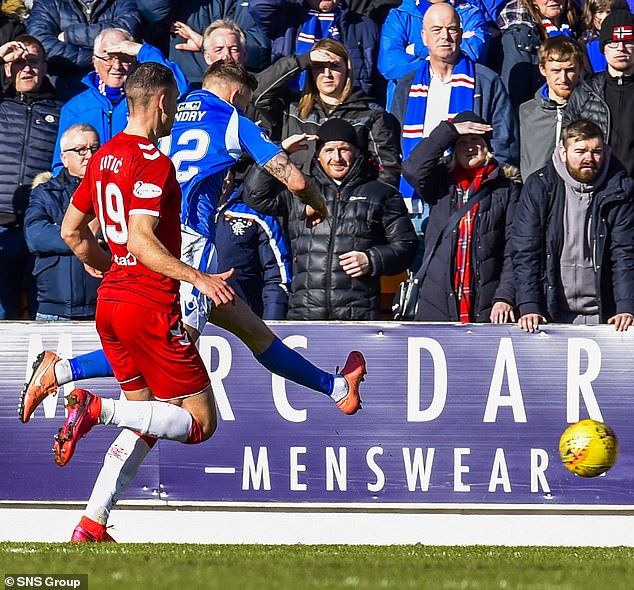
Identify the location of wall. The height and width of the screenshot is (590, 634). (524, 489).